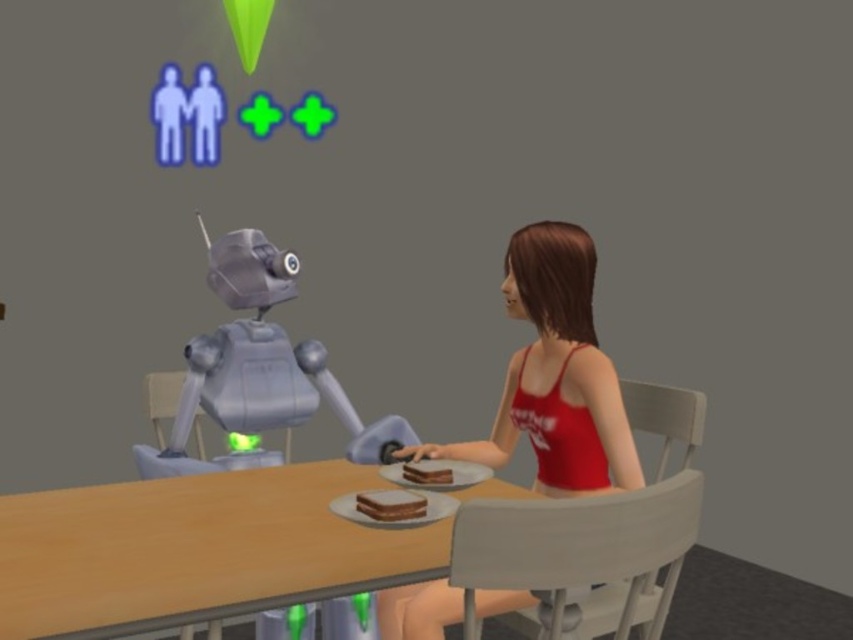
The image size is (853, 640). Find the location of `white plastic chair at lower right`. white plastic chair at lower right is located at coordinates (579, 552).

Who is positioned more to the left, white plastic chair at lower right or chocolate cake at table?

chocolate cake at table is more to the left.

Is point (686, 544) positioned after point (442, 467)?

No, (686, 544) is in front of (442, 467).

The width and height of the screenshot is (853, 640). Find the location of `white plastic chair at lower right`. white plastic chair at lower right is located at coordinates (579, 552).

Is red matte tank top at center above metallic gray chair at left?

Yes, red matte tank top at center is above metallic gray chair at left.

Which is more to the right, red matte tank top at center or metallic gray chair at left?

red matte tank top at center is more to the right.

Image resolution: width=853 pixels, height=640 pixels. What do you see at coordinates (554, 374) in the screenshot?
I see `red matte tank top at center` at bounding box center [554, 374].

Identify the location of red matte tank top at center. (554, 374).

Which is in front, point (160, 385) or point (398, 508)?

Point (398, 508) is in front.

Does metallic gray chair at left have a greater width compared to chocolate cake at center?

Yes.

Locate an element on the screen. This screenshot has height=640, width=853. metallic gray chair at left is located at coordinates (161, 397).